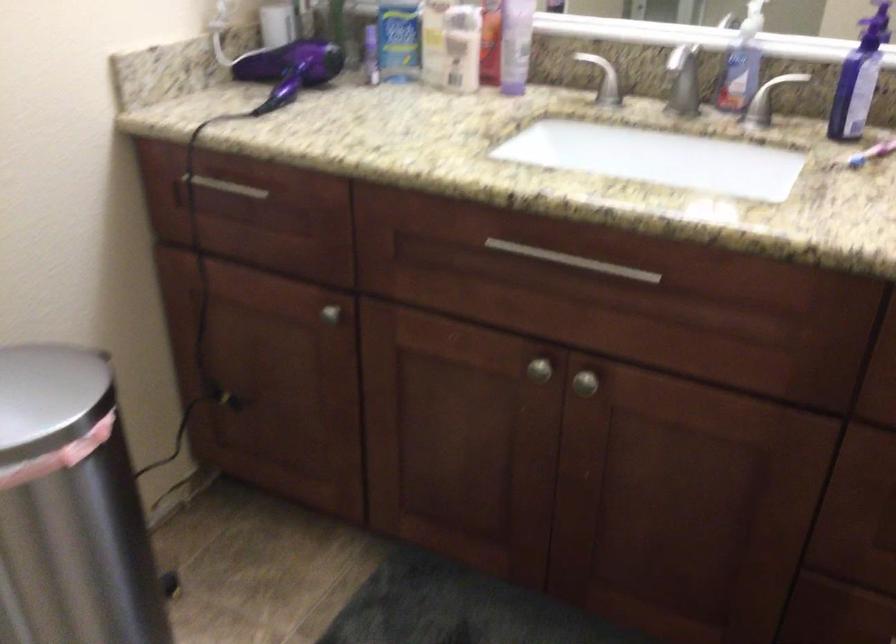
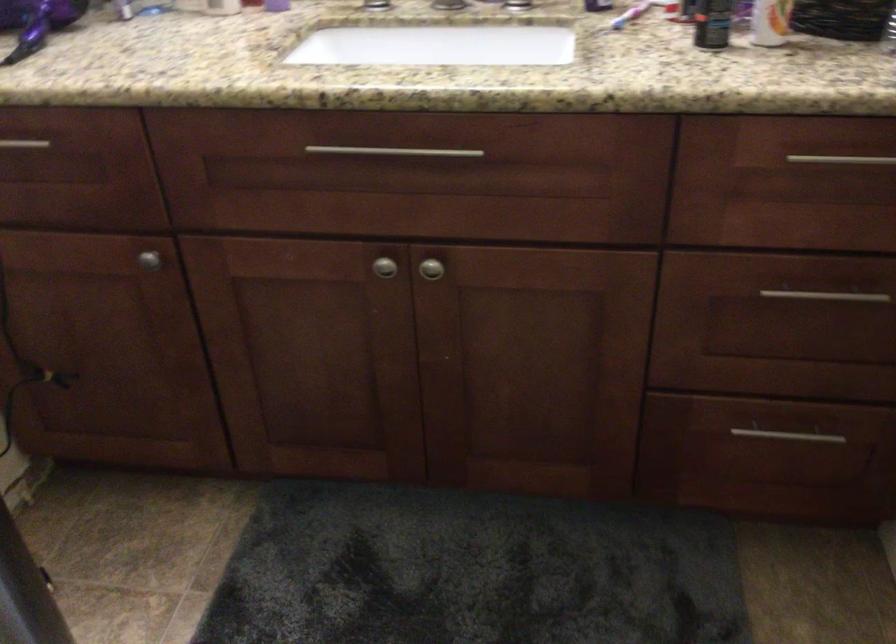
Find the pixel in the second image that matches (x=572, y=259) in the first image.

(394, 152)